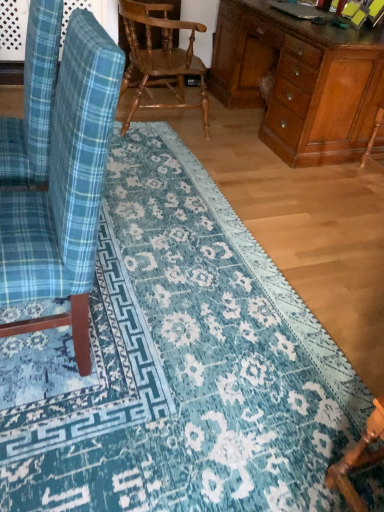
Image resolution: width=384 pixels, height=512 pixels. What are the coordinates of `free spot in front of wooden desk at right` in the screenshot? It's located at (284, 191).